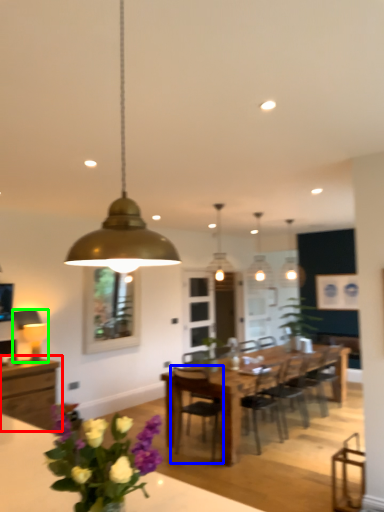
Question: Estimate the real-world distances between objects in this image. Which object is closer to cabinetry (highlighted by a red box), chair (highlighted by a blue box) or lamp (highlighted by a green box)?

Choices:
 (A) chair
 (B) lamp

Answer: (B)